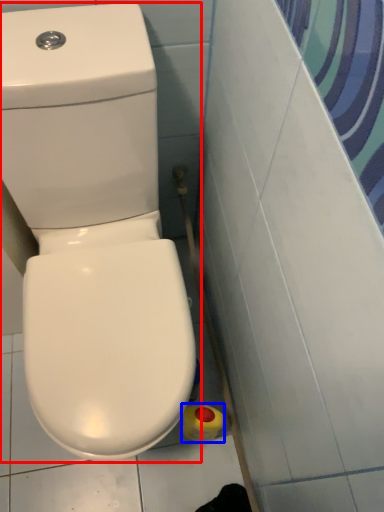
Question: Which point is further to the camera, toilet (highlighted by a red box) or cleaning product (highlighted by a blue box)?

Choices:
 (A) toilet
 (B) cleaning product

Answer: (B)